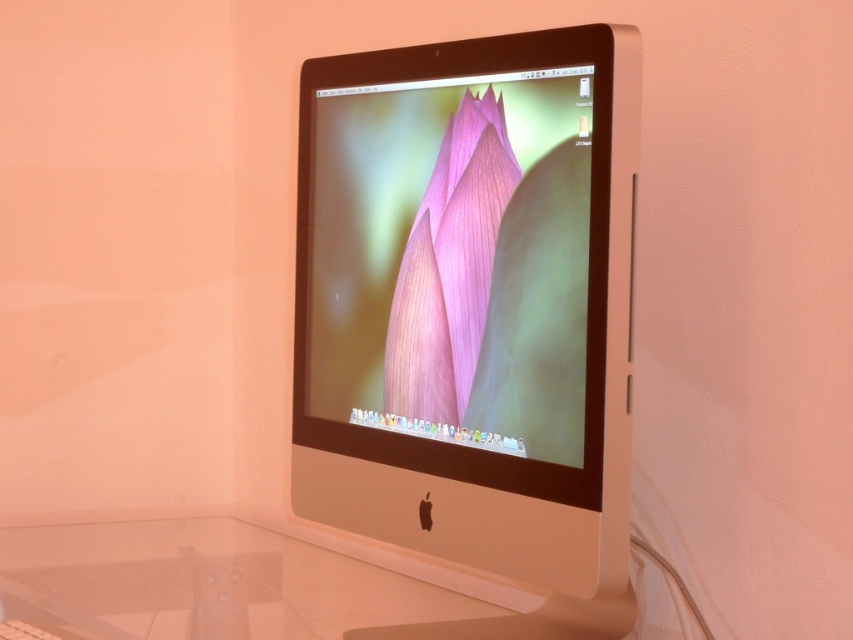
Question: Is the position of satin white monitor at center more distant than that of satin gold desktop at center?

Choices:
 (A) yes
 (B) no

Answer: (B)

Question: Which of the following is the closest to the observer?

Choices:
 (A) (279, 554)
 (B) (461, 298)
 (C) (553, 160)

Answer: (C)

Question: Is satin white monitor at center thinner than satin gold desktop at center?

Choices:
 (A) no
 (B) yes

Answer: (B)

Question: Is satin gold desktop at center in front of pink matte flower at center?

Choices:
 (A) yes
 (B) no

Answer: (B)

Question: Which object is the farthest from the satin gold desktop at center?

Choices:
 (A) satin white monitor at center
 (B) pink matte flower at center

Answer: (B)

Question: Which of these objects is positioned closest to the satin white monitor at center?

Choices:
 (A) satin gold desktop at center
 (B) pink matte flower at center

Answer: (B)